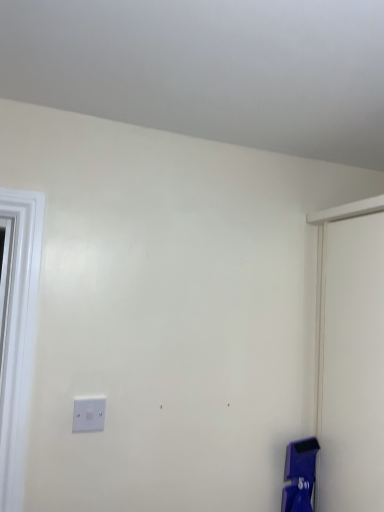
Describe the element at coordinates (89, 414) in the screenshot. This screenshot has height=512, width=384. I see `white plastic light switch at center` at that location.

What is the approximate width of white plastic light switch at center?

white plastic light switch at center is 1.54 centimeters wide.

Measure the distance between point (103, 416) and camera.

Point (103, 416) is 1.21 meters away from camera.

At what (x,y) coordinates should I click in order to perform the action: click on white plastic light switch at center. Please return your answer as a coordinate pair (x, y). The height and width of the screenshot is (512, 384). Looking at the image, I should click on (89, 414).

Find the location of a particular element. Image resolution: width=384 pixels, height=512 pixels. white plastic light switch at center is located at coordinates pyautogui.click(x=89, y=414).